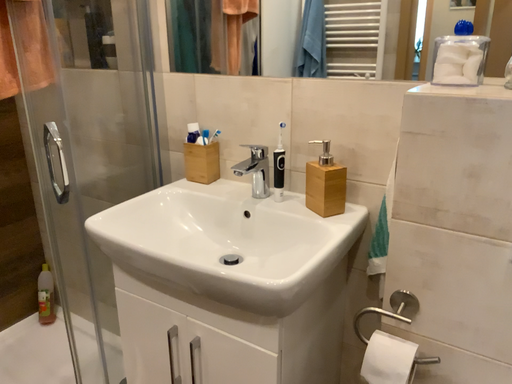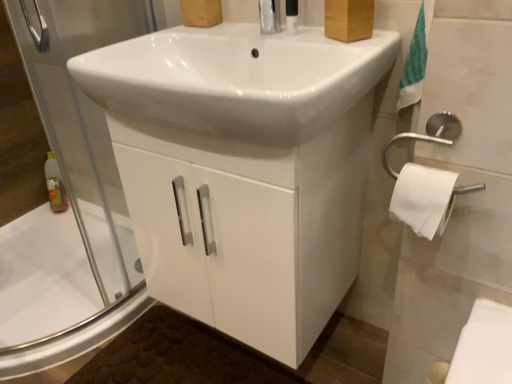
Question: Which way did the camera rotate in the video?

Choices:
 (A) rotated downward
 (B) rotated upward

Answer: (A)